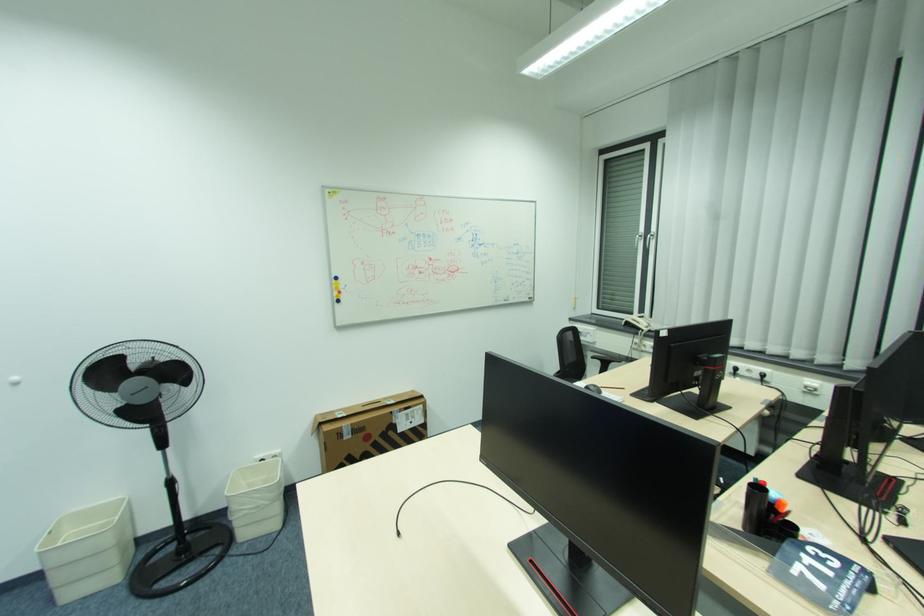
Find the location of `white telephone handset`. white telephone handset is located at coordinates click(638, 322).